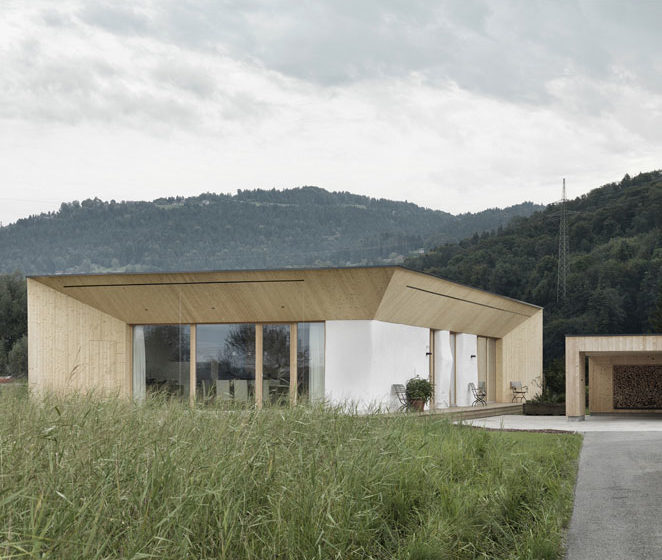
Identify the location of the front wall. (400, 357).